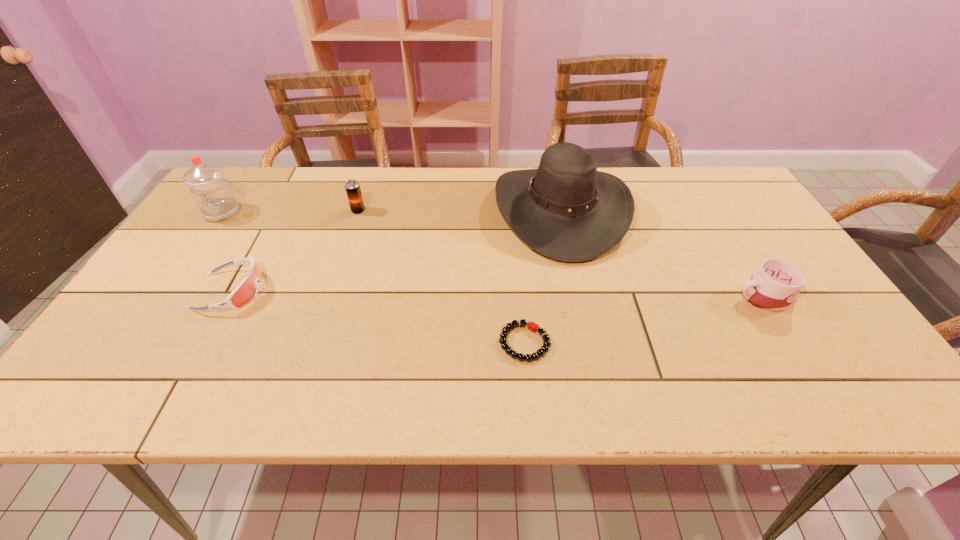
You are a GUI agent. You are given a task and a screenshot of the screen. Output one action in this format:
    pyautogui.click(x=<x>, y=<y>)
    Task: Click on the free space at the right edge of the desktop
    
    Given the screenshot: What is the action you would take?
    pyautogui.click(x=751, y=241)

Where is `free space at the far right corner of the desktop`? The height and width of the screenshot is (540, 960). free space at the far right corner of the desktop is located at coordinates (682, 172).

I want to click on free spot between the fifth object from right to left and the bracelet, so click(x=377, y=316).

In order to click on blank region between the shortest object and the third object from left to right in this screenshot , I will do `click(442, 276)`.

Locate an element on the screen. The height and width of the screenshot is (540, 960). vacant area that lies between the bracelet and the fourth shortest object is located at coordinates pos(442,276).

The width and height of the screenshot is (960, 540). In order to click on empty space between the nearest object and the goggles in this screenshot , I will do `click(377, 316)`.

You are a GUI agent. You are given a task and a screenshot of the screen. Output one action in this format:
    pyautogui.click(x=<x>, y=<y>)
    Task: Click on the vacant area that lies between the bracelet and the third shortest object
    This screenshot has width=960, height=540.
    Given the screenshot: What is the action you would take?
    click(644, 320)

Identify the location of free space between the third object from left to right and the cowboy hat. (460, 211).

This screenshot has width=960, height=540. I want to click on free space between the nearest object and the mug, so click(644, 320).

Identify the location of unoccupied position between the cowboy hat and the second shortest object. This screenshot has width=960, height=540. (396, 251).